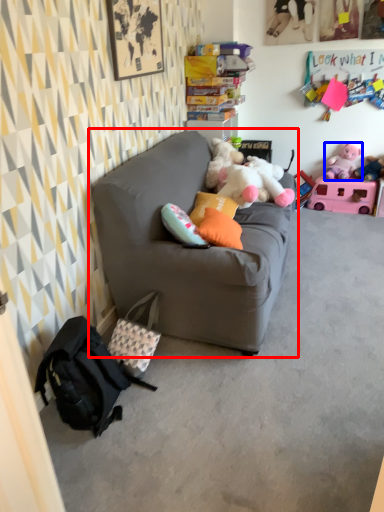
Question: Among these objects, which one is nearest to the camera, studio couch (highlighted by a red box) or toy (highlighted by a blue box)?

Choices:
 (A) studio couch
 (B) toy

Answer: (A)